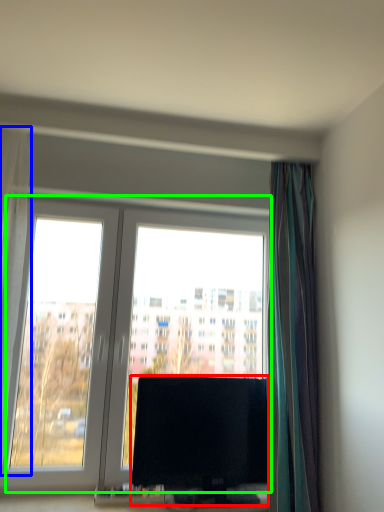
Question: Estimate the real-world distances between objects in this image. Which object is farther from television (highlighted by a red box), curtain (highlighted by a blue box) or window (highlighted by a green box)?

Choices:
 (A) curtain
 (B) window

Answer: (A)